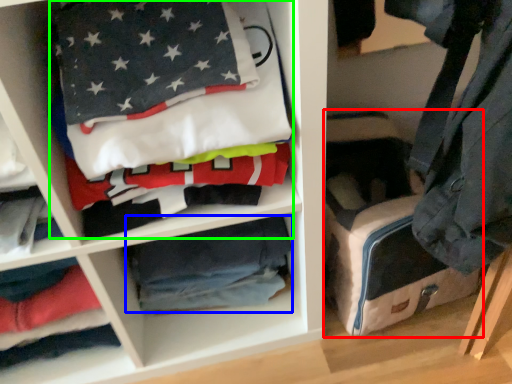
Question: Based on their relative distances, which object is farther from pack (highlighted by a red box)? Choose from material (highlighted by a blue box) and laundry (highlighted by a green box).

Choices:
 (A) material
 (B) laundry

Answer: (B)